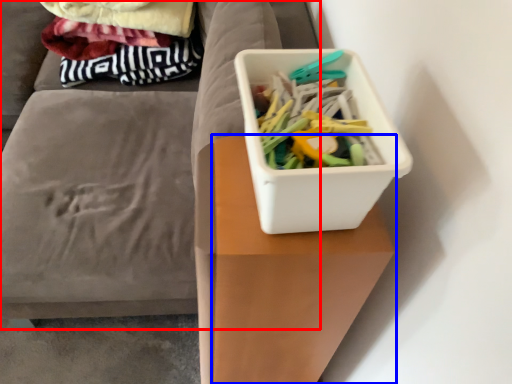
Question: Which of the following is the closest to the observer, furniture (highlighted by a red box) or table (highlighted by a blue box)?

Choices:
 (A) furniture
 (B) table

Answer: (B)